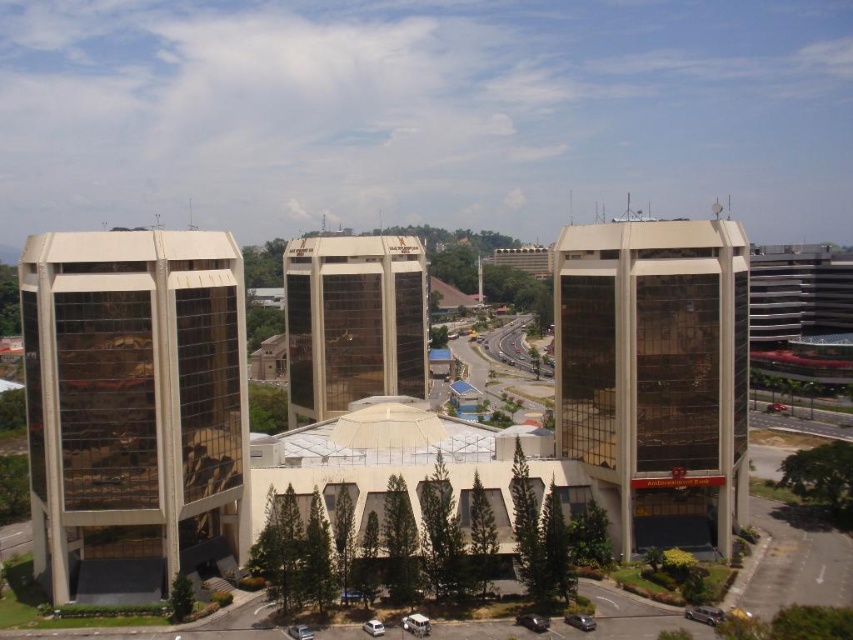
From the picture: Who is lower down, gold reflective glass building at left or gold reflective glass building at center?

gold reflective glass building at left

Who is positioned more to the left, gold reflective glass building at left or gold reflective glass building at center?

gold reflective glass building at left

Is point (190, 548) closer to viewer compared to point (341, 280)?

Yes.

Find the location of a particular element. gold reflective glass building at left is located at coordinates (132, 406).

Who is taller, matte glass building at center or gold reflective glass building at center?

Standing taller between the two is matte glass building at center.

Does matte glass building at center appear over gold reflective glass building at center?

Yes.

Is point (740, 314) farther from camera compared to point (392, 376)?

No, it is not.

Identify the location of matte glass building at center. This screenshot has width=853, height=640. (656, 374).

How far apart are gold reflective glass building at left and matte glass building at center?

gold reflective glass building at left and matte glass building at center are 38.04 meters apart from each other.

Does gold reflective glass building at left have a lesser height compared to matte glass building at center?

In fact, gold reflective glass building at left may be taller than matte glass building at center.

The width and height of the screenshot is (853, 640). What are the coordinates of `gold reflective glass building at left` in the screenshot? It's located at (132, 406).